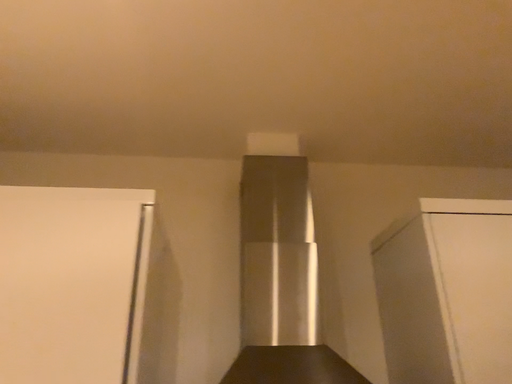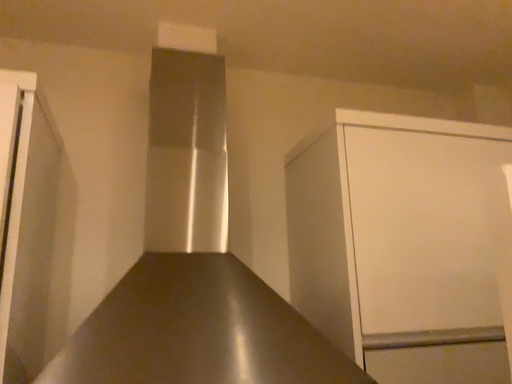
Question: Which way did the camera rotate in the video?

Choices:
 (A) rotated upward
 (B) rotated downward

Answer: (B)